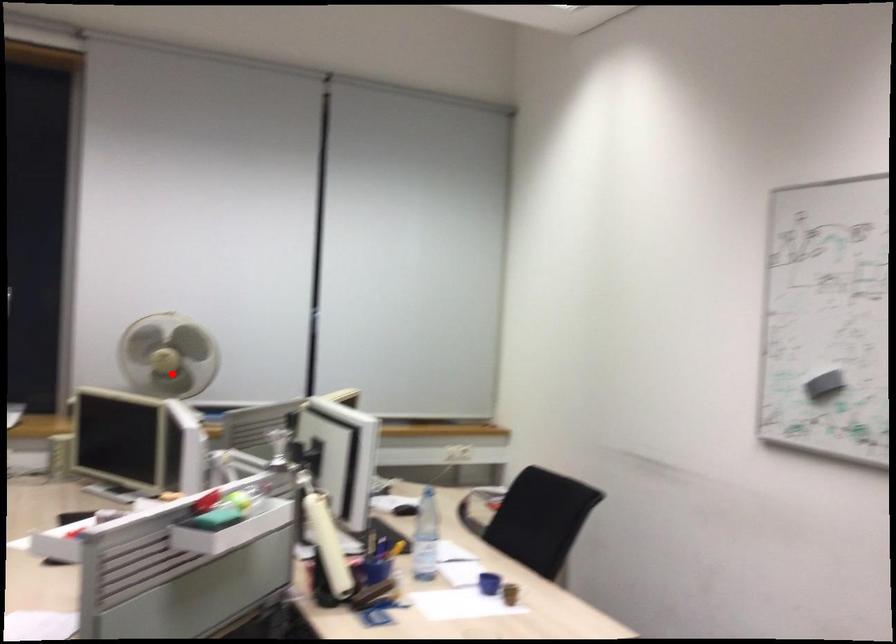
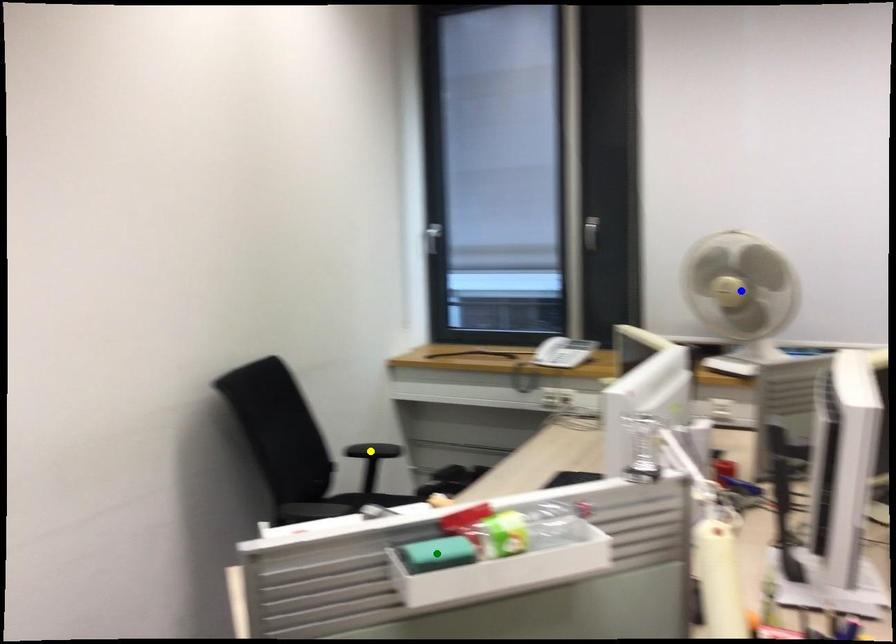
Question: I am providing you with two images of the same scene from different viewpoints. A red point is marked on the first image. You are given multiple points on the second image. Which point in image 2 represents the same 3d spot as the red point in image 1?

Choices:
 (A) blue point
 (B) yellow point
 (C) green point

Answer: (A)